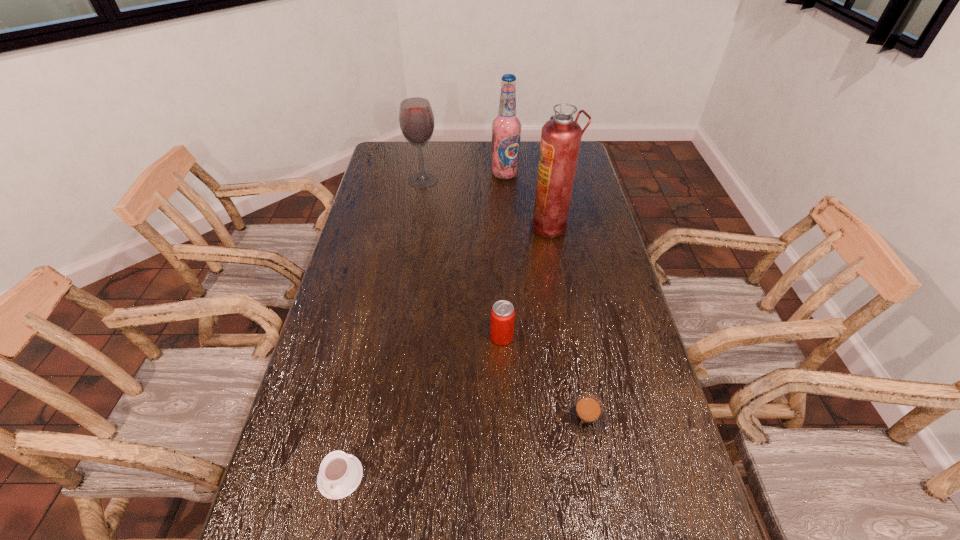
The width and height of the screenshot is (960, 540). Identify the location of unoccupied position between the teacup and the right alcohol. (422, 325).

Locate an element on the screen. empty location between the nearest object and the fire extinguisher is located at coordinates (445, 352).

You are a GUI agent. You are given a task and a screenshot of the screen. Output one action in this format:
    pyautogui.click(x=<x>, y=<y>)
    Task: Click on the free spot between the shorter alcohol and the third nearest object
    
    Given the screenshot: What is the action you would take?
    pyautogui.click(x=463, y=258)

Find the location of a particular element. The height and width of the screenshot is (540, 960). vacant area that lies between the cappuccino and the fire extinguisher is located at coordinates (568, 322).

Identify the location of vacant point located between the can and the right alcohol. (503, 255).

In order to click on the fourth closest object to the fourth shortest object in this screenshot , I will do `click(585, 414)`.

Identify which object is the fifth nearest to the fourth nearest object. Please provide its 2D coordinates. Your answer should be formatted as a tuple, i.e. [(x, y)], where the tuple contains the x and y coordinates of a point satisfying the conditions above.

[(340, 474)]

This screenshot has height=540, width=960. What are the coordinates of `vacant space that satisfies the following two spatial constraints: 1. on the side of the fourth nearest object with the label; 2. on the front side of the can` in the screenshot? It's located at (570, 337).